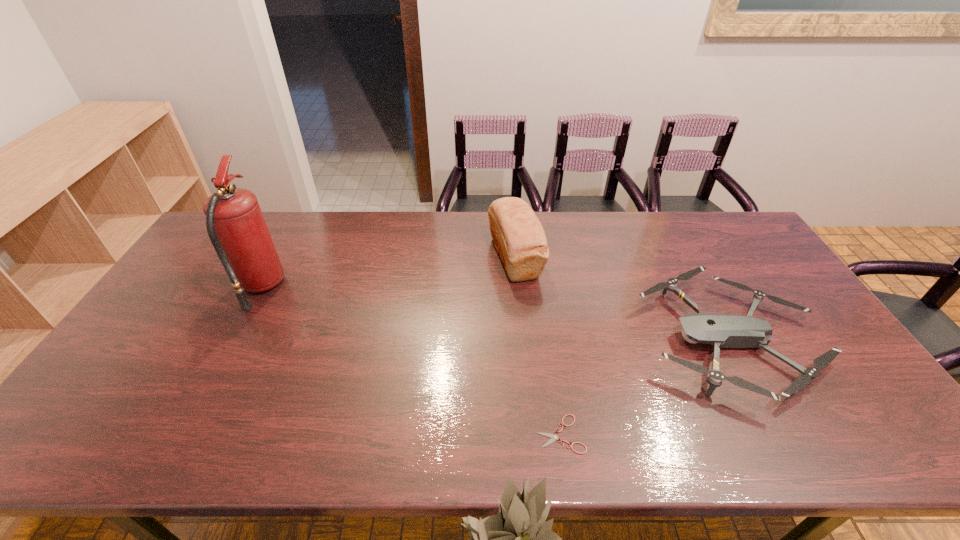
Where is `free space located 0.310m with a camera mounted on the front of the drone`? Image resolution: width=960 pixels, height=540 pixels. free space located 0.310m with a camera mounted on the front of the drone is located at coordinates (530, 340).

Where is `free space located 0.100m on the left of the shears`? free space located 0.100m on the left of the shears is located at coordinates (492, 434).

Image resolution: width=960 pixels, height=540 pixels. Identify the location of object situated at the far edge. (520, 240).

You are a GUI agent. You are given a task and a screenshot of the screen. Output one action in this format:
    pyautogui.click(x=<x>, y=<y>)
    Task: Click on the object that is at the near edge
    The image size is (960, 540).
    Given the screenshot: What is the action you would take?
    pyautogui.click(x=554, y=437)

At what (x,y) coordinates should I click in order to perform the action: click on object positioned at the right edge. Please return your answer as a coordinate pair (x, y). Image resolution: width=960 pixels, height=540 pixels. Looking at the image, I should click on (725, 331).

In the image, there is a desktop. Identify the location of vacant region at the far edge. This screenshot has height=540, width=960. point(627,213).

Image resolution: width=960 pixels, height=540 pixels. I want to click on vacant space at the near edge of the desktop, so click(x=523, y=443).

In order to click on free space at the left edge of the desktop in this screenshot , I will do `click(119, 389)`.

Where is `blank space at the right edge`? The height and width of the screenshot is (540, 960). blank space at the right edge is located at coordinates (846, 391).

The height and width of the screenshot is (540, 960). I want to click on vacant area between the rightmost object and the fire extinguisher, so click(495, 314).